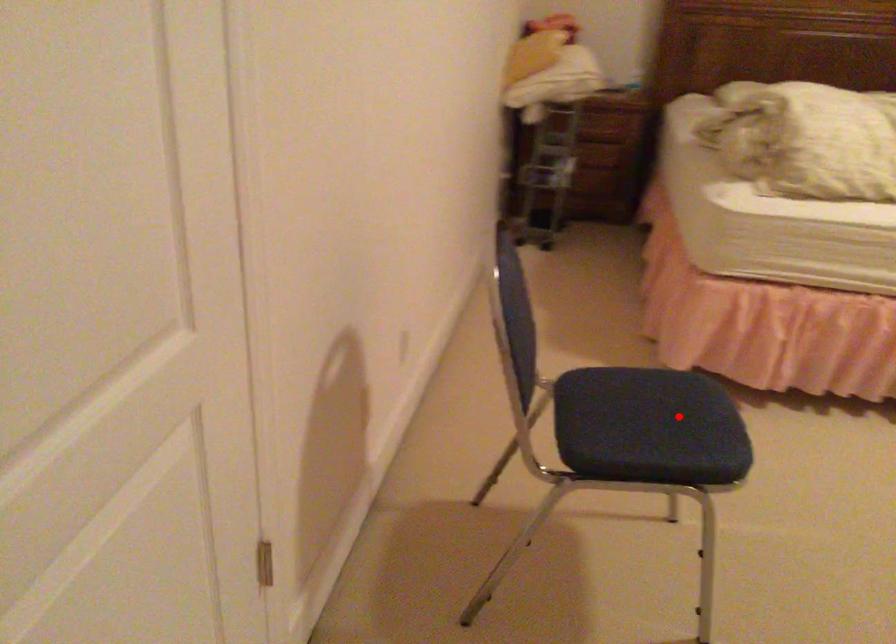
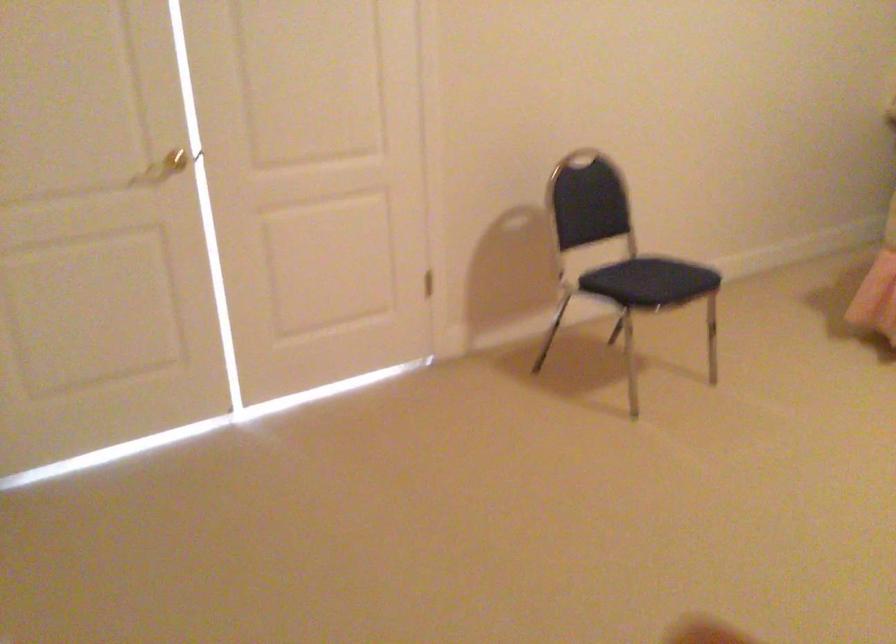
Find the pixel in the second image that matches the highlighted location in the first image.

(657, 276)